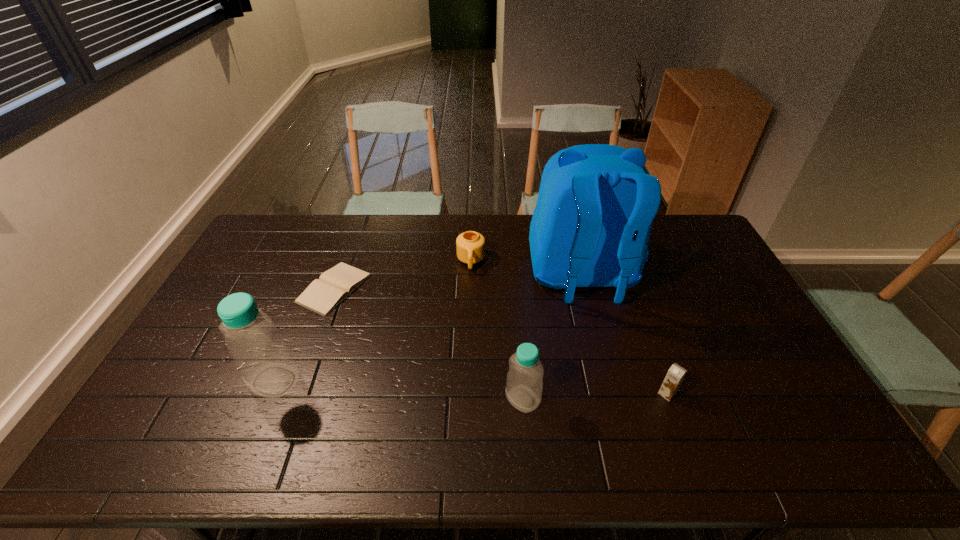
The height and width of the screenshot is (540, 960). I want to click on free location located 0.280m on the back of the backpack, so click(x=613, y=397).

Where is `vacant space positioned 0.210m on the front of the Bible`? The height and width of the screenshot is (540, 960). vacant space positioned 0.210m on the front of the Bible is located at coordinates (303, 373).

The width and height of the screenshot is (960, 540). In order to click on free space located 0.240m on the handle side of the mug in this screenshot , I will do `click(469, 327)`.

I want to click on vacant space located 0.360m on the left of the chocolate milk, so click(522, 394).

The width and height of the screenshot is (960, 540). I want to click on backpack that is at the far edge, so click(x=596, y=203).

You are a GUI agent. You are given a task and a screenshot of the screen. Output one action in this format:
    pyautogui.click(x=<x>, y=<y>)
    Task: Click on the mug that is at the far edge
    The height and width of the screenshot is (540, 960).
    Given the screenshot: What is the action you would take?
    pyautogui.click(x=470, y=246)

Where is `chocolate milk situated at the near edge`? chocolate milk situated at the near edge is located at coordinates (675, 375).

Identify the location of free region at the far edge. (408, 218).

This screenshot has height=540, width=960. In the image, there is a desktop. Identify the location of vacant space at the near edge. (655, 404).

The width and height of the screenshot is (960, 540). Identify the location of vacant region at the left edge. (216, 369).